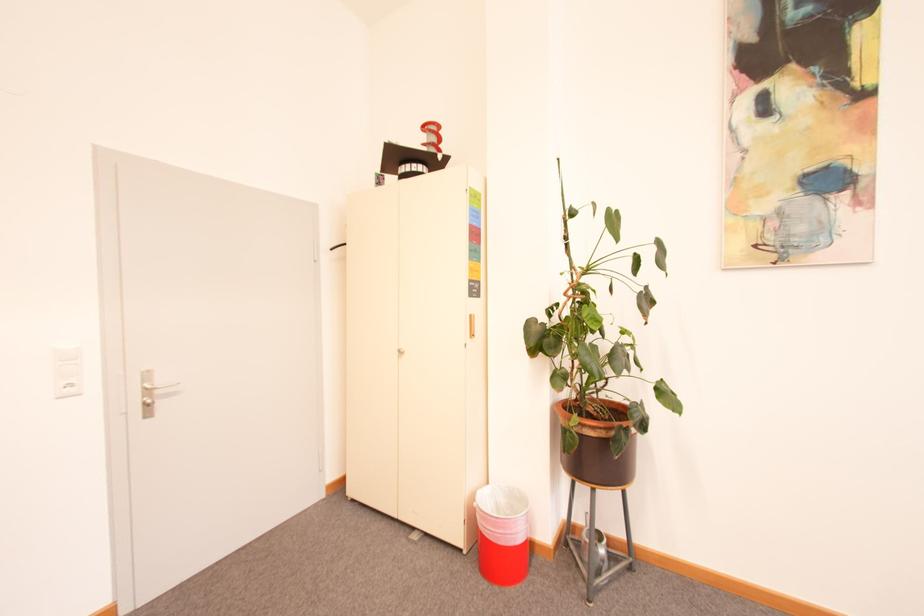
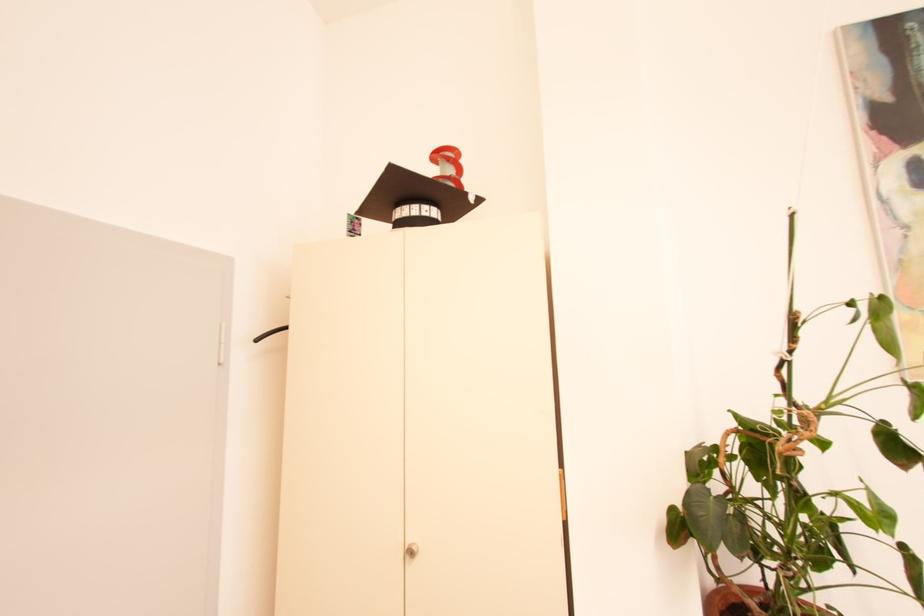
The point at (436, 132) is marked in the first image. Where is the corresponding point in the second image?

(455, 160)